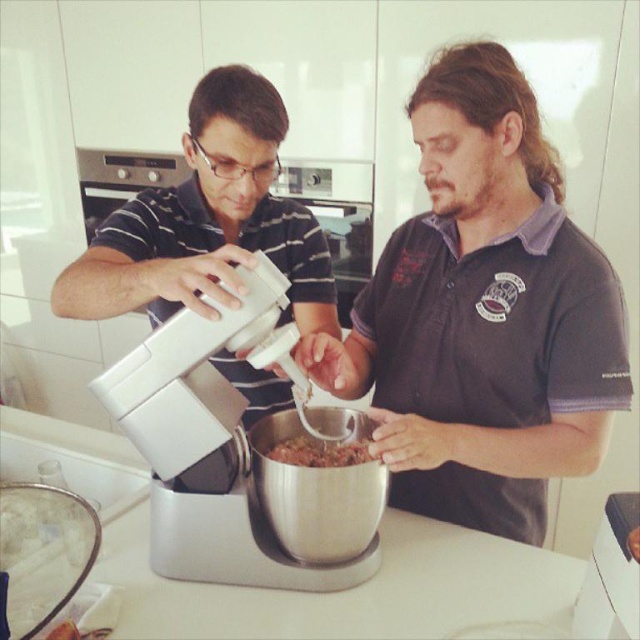
Question: Which of the following is the farthest from the observer?

Choices:
 (A) silver metallic mixer at center
 (B) dark gray shirt at center

Answer: (B)

Question: Which point is farther to the camera?

Choices:
 (A) brown crumbly mixture at center
 (B) dark gray shirt at center

Answer: (A)

Question: Which point appears closest to the camera in this image?

Choices:
 (A) (241, 538)
 (B) (436, 328)

Answer: (A)

Question: Is dark gray shirt at center wider than silver metallic mixer at center?

Choices:
 (A) no
 (B) yes

Answer: (B)

Question: Does dark gray shirt at center have a smaller size compared to white matte mixer at center?

Choices:
 (A) yes
 (B) no

Answer: (A)

Question: Is dark gray shirt at center smaller than white matte mixer at center?

Choices:
 (A) no
 (B) yes

Answer: (B)